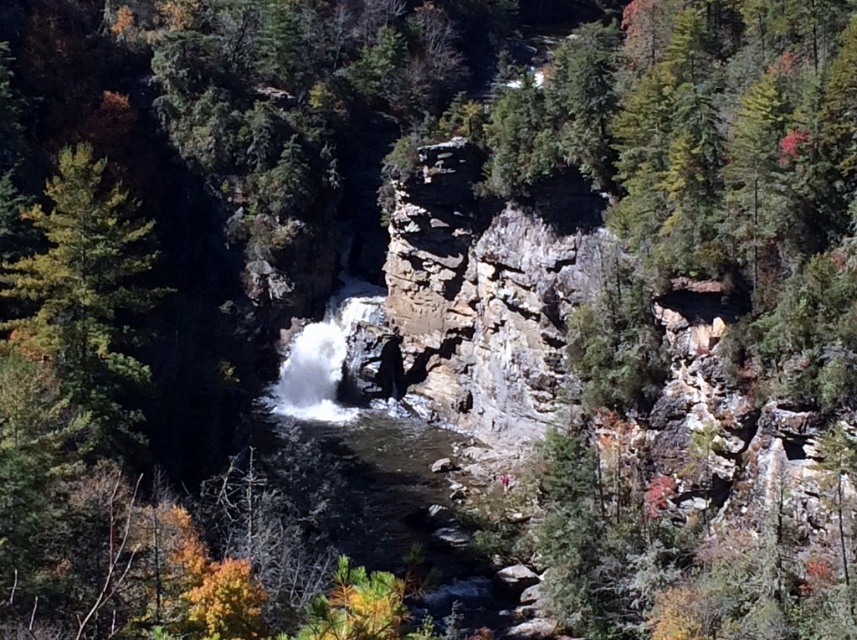
Question: Among these objects, which one is nearest to the camera?

Choices:
 (A) green matte tree at left
 (B) white frothy water at center

Answer: (A)

Question: Can you confirm if green matte tree at left is thinner than white frothy water at center?

Choices:
 (A) yes
 (B) no

Answer: (B)

Question: In this image, where is green matte tree at left located relative to white frothy water at center?

Choices:
 (A) below
 (B) above

Answer: (B)

Question: Which of the following is the farthest from the observer?

Choices:
 (A) (330, 353)
 (B) (27, 276)

Answer: (A)

Question: Which point appears closest to the camera in this image?

Choices:
 (A) (346, 298)
 (B) (127, 300)

Answer: (B)

Question: Can you confirm if green matte tree at left is thinner than white frothy water at center?

Choices:
 (A) yes
 (B) no

Answer: (B)